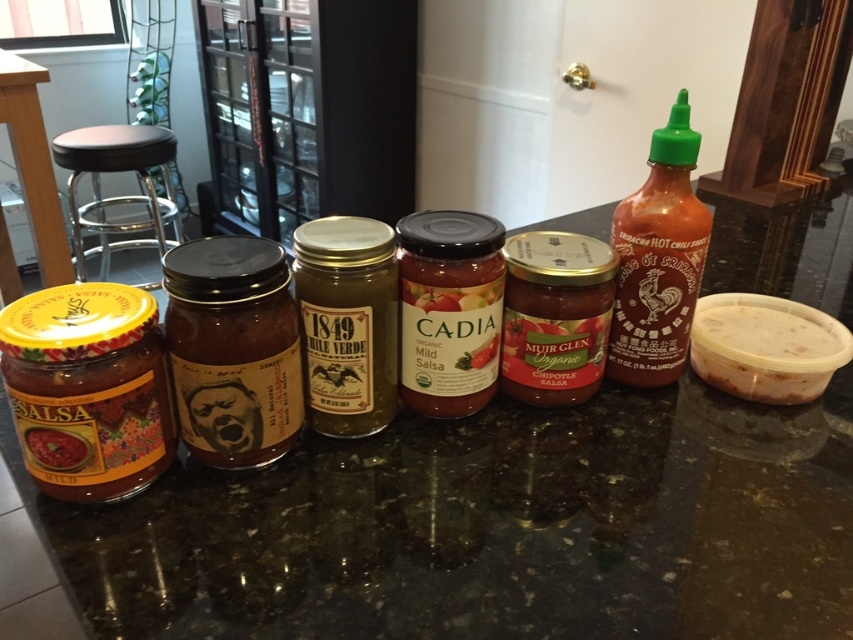
From the picture: You are organizing the condiments on the countertop and need to place a new item between the white plastic container at right and the matte glass jar at left. Which side should you place it closer to if you want it to be closer to the viewer?

You should place the new item closer to the white plastic container at right because it is already further to the viewer than the matte glass jar at left, so positioning it near the container will keep it closer to you.

Consider the image. You are a chef preparing a dish and need to reach for both the green plastic bottle at right and the matte glass jar at left. Considering the distance between them, can you comfortably grab both items without moving your hand more than 50 centimeters?

The distance between the green plastic bottle at right and the matte glass jar at left is 48.04 centimeters, so yes, you can comfortably grab both items without moving your hand more than 50 centimeters.